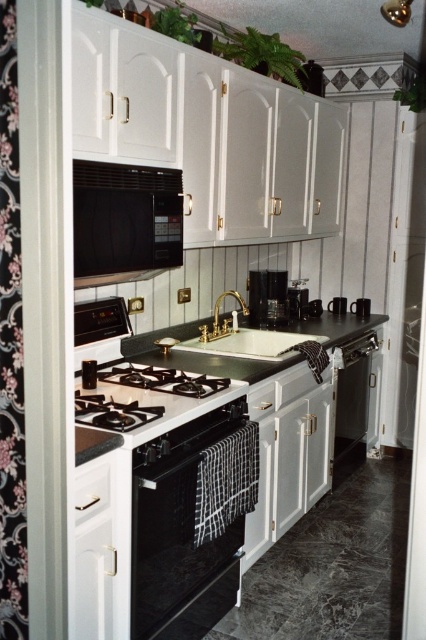
You are organizing the kitchen and need to place the white matte drawer at lower left and the black matte coffee pot at center into a storage box. The storage box can only hold items smaller than the coffee pot. Which item can fit into the storage box?

The white matte drawer at lower left is smaller than the black matte coffee pot at center, so it can fit into the storage box.

You are trying to place a new appliance in the kitchen. The stainless steel gas stove at center is currently occupying space. Can the black matte coffee pot at center fit in the same area if you remove the stove?

The stainless steel gas stove at center is bigger than the black matte coffee pot at center, so if you remove the stove, the area will be sufficient to fit the black matte coffee pot at center.